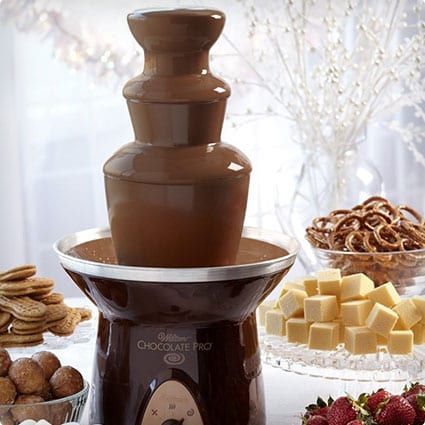
The height and width of the screenshot is (425, 425). Identify the location of pretzels bowl. (402, 260).